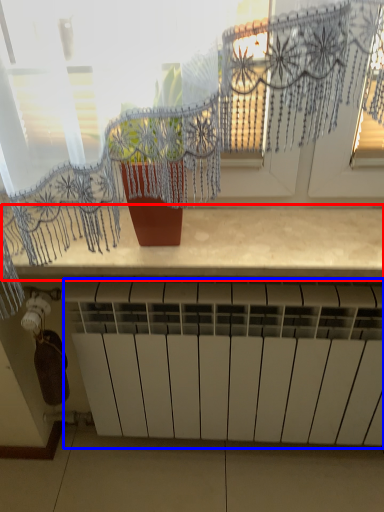
Question: Among these objects, which one is nearest to the camera, counter top (highlighted by a red box) or radiator (highlighted by a blue box)?

Choices:
 (A) counter top
 (B) radiator

Answer: (A)